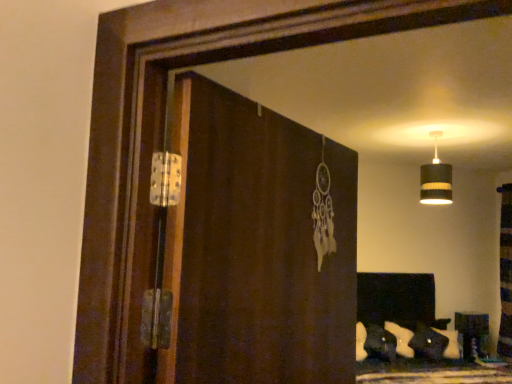
Question: Is wooden bookshelf at right taller than brown wooden screen door at center?

Choices:
 (A) yes
 (B) no

Answer: (B)

Question: Can you confirm if wooden bookshelf at right is positioned to the right of brown wooden screen door at center?

Choices:
 (A) no
 (B) yes

Answer: (B)

Question: Is wooden bookshelf at right in contact with brown wooden screen door at center?

Choices:
 (A) yes
 (B) no

Answer: (B)

Question: Is wooden bookshelf at right far from brown wooden screen door at center?

Choices:
 (A) yes
 (B) no

Answer: (A)

Question: Is wooden bookshelf at right outside of brown wooden screen door at center?

Choices:
 (A) yes
 (B) no

Answer: (A)

Question: Could you tell me if wooden bookshelf at right is facing brown wooden screen door at center?

Choices:
 (A) no
 (B) yes

Answer: (A)

Question: Is black striped lampshade at upper right positioned with its back to wooden bookshelf at right?

Choices:
 (A) no
 (B) yes

Answer: (A)

Question: Is black striped lampshade at upper right aimed at wooden bookshelf at right?

Choices:
 (A) yes
 (B) no

Answer: (B)

Question: Is black striped lampshade at upper right not within wooden bookshelf at right?

Choices:
 (A) yes
 (B) no

Answer: (A)

Question: From a real-world perspective, is black striped lampshade at upper right below wooden bookshelf at right?

Choices:
 (A) yes
 (B) no

Answer: (B)

Question: Is black striped lampshade at upper right with wooden bookshelf at right?

Choices:
 (A) yes
 (B) no

Answer: (B)

Question: Is black striped lampshade at upper right surrounding wooden bookshelf at right?

Choices:
 (A) no
 (B) yes

Answer: (A)

Question: Is brown wooden screen door at center far away from black striped lampshade at upper right?

Choices:
 (A) no
 (B) yes

Answer: (B)